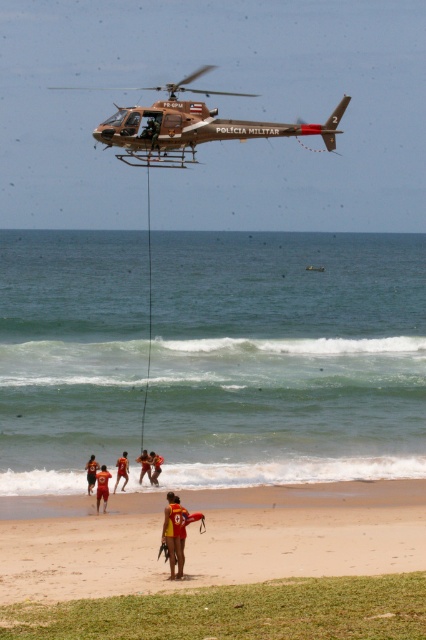
You are a drone operator trying to capture a photo of the matte brown helicopter at upper center. The camera is currently pointing at coordinates 0.2, 0.45. Is the helicopter in the camera frame?

The matte brown helicopter at upper center is located at 2D coordinates (193, 125). Since the camera is pointing at (191, 128), the helicopter is very close to the camera frame and likely within it.

You are a drone operator trying to capture a photo of the yellow life vest at center without the matte brown helicopter at upper center blocking the view. Can you angle your drone camera downward enough to avoid the helicopter?

The matte brown helicopter at upper center is much taller than the yellow life vest at center, so angling the drone camera downward might not be sufficient to avoid the helicopter blocking the view. The helicopter is significantly taller, so it may still obstruct the shot unless positioned far enough away.

You are a photographer trying to capture a wide shot of the rescue operation. The matte brown helicopter at upper center and the yellow life vest at center are both in your frame. If you want to ensure both fit comfortably in the photo, which object should you focus on to avoid cropping?

The matte brown helicopter at upper center is wider than the yellow life vest at center, so focusing on the matte brown helicopter at upper center will ensure both fit comfortably without cropping.